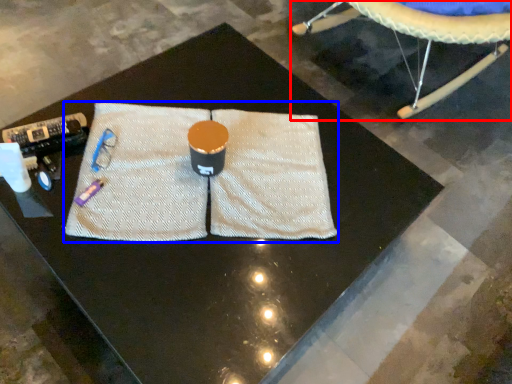
Question: Which object appears closest to the camera in this image, swivel chair (highlighted by a red box) or yoga mat (highlighted by a blue box)?

Choices:
 (A) swivel chair
 (B) yoga mat

Answer: (B)